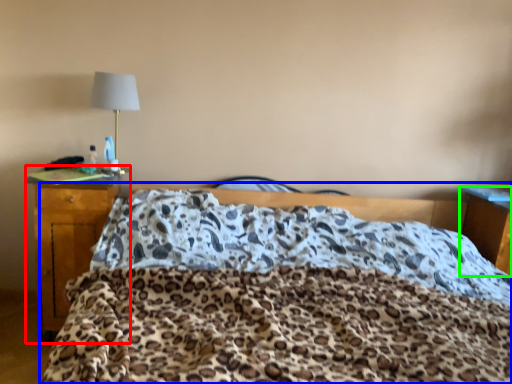
Question: Which object is the farthest from desk (highlighted by a red box)? Choose among these: bed (highlighted by a blue box) or nightstand (highlighted by a green box).

Choices:
 (A) bed
 (B) nightstand

Answer: (B)